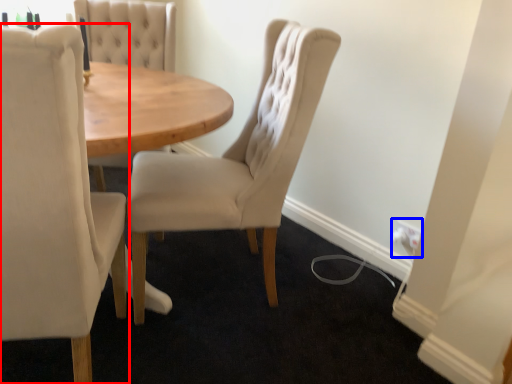
Question: Which point is further to the camera, chair (highlighted by a red box) or electric outlet (highlighted by a blue box)?

Choices:
 (A) chair
 (B) electric outlet

Answer: (B)